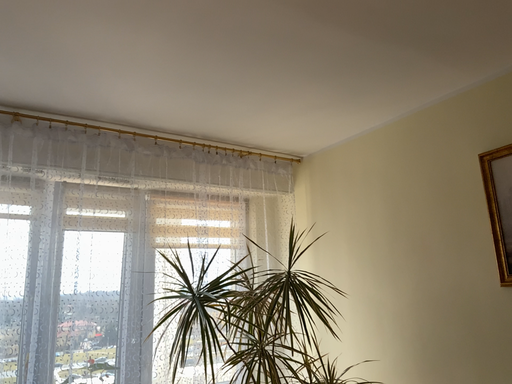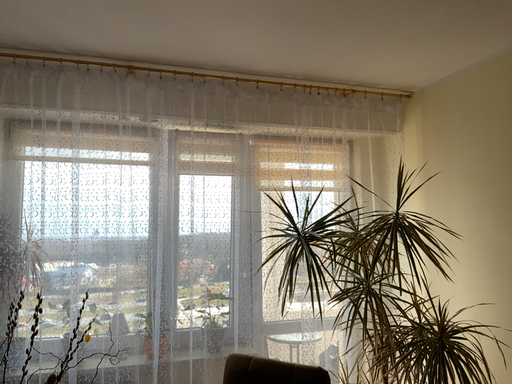
Question: Which way did the camera rotate in the video?

Choices:
 (A) rotated right
 (B) rotated left

Answer: (B)